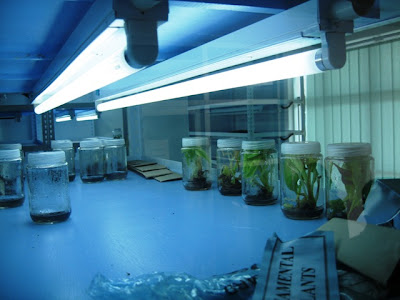
The width and height of the screenshot is (400, 300). I want to click on lights, so click(x=80, y=116), click(x=62, y=116), click(x=76, y=70), click(x=173, y=94).